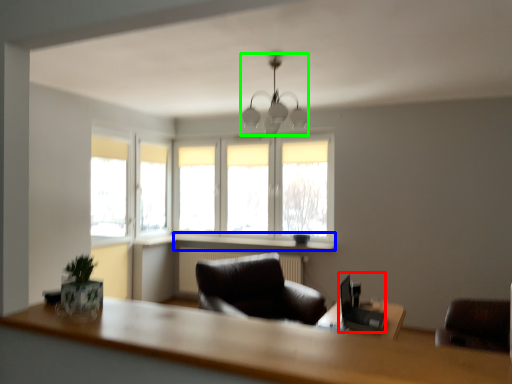
Question: Which is nearer to the computer desk (highlighted by a red box)? window sill (highlighted by a blue box) or lamp (highlighted by a green box).

Choices:
 (A) window sill
 (B) lamp

Answer: (A)